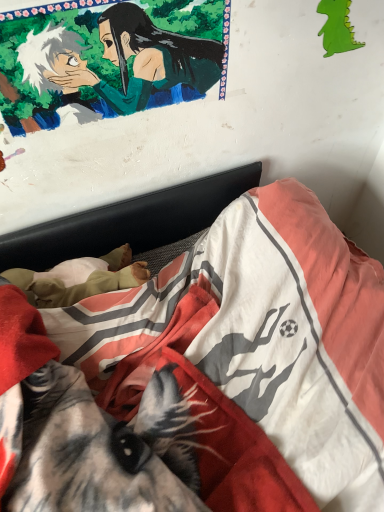
Question: Are smooth green fabric at upper left and green paper dragon at upper right far apart?

Choices:
 (A) no
 (B) yes

Answer: (A)

Question: Considering the relative sizes of smooth green fabric at upper left and green paper dragon at upper right in the image provided, is smooth green fabric at upper left bigger than green paper dragon at upper right?

Choices:
 (A) no
 (B) yes

Answer: (B)

Question: From the image's perspective, would you say smooth green fabric at upper left is shown under green paper dragon at upper right?

Choices:
 (A) yes
 (B) no

Answer: (A)

Question: From a real-world perspective, is smooth green fabric at upper left located higher than green paper dragon at upper right?

Choices:
 (A) no
 (B) yes

Answer: (B)

Question: Does smooth green fabric at upper left have a smaller size compared to green paper dragon at upper right?

Choices:
 (A) no
 (B) yes

Answer: (A)

Question: From a real-world perspective, is smooth green fabric at upper left above or below soft cotton bed at center?

Choices:
 (A) below
 (B) above

Answer: (B)

Question: Is smooth green fabric at upper left taller or shorter than soft cotton bed at center?

Choices:
 (A) tall
 (B) short

Answer: (B)

Question: Is smooth green fabric at upper left to the left or to the right of soft cotton bed at center in the image?

Choices:
 (A) right
 (B) left

Answer: (B)

Question: Does point coord(109,93) appear closer or farther from the camera than point coord(170,420)?

Choices:
 (A) closer
 (B) farther

Answer: (A)

Question: In terms of width, does smooth green fabric at upper left look wider or thinner when compared to green paper dragon at upper right?

Choices:
 (A) wide
 (B) thin

Answer: (A)

Question: Would you say smooth green fabric at upper left is inside or outside green paper dragon at upper right?

Choices:
 (A) outside
 (B) inside

Answer: (A)

Question: From the image's perspective, is smooth green fabric at upper left above or below green paper dragon at upper right?

Choices:
 (A) below
 (B) above

Answer: (A)

Question: Looking at the image, does smooth green fabric at upper left seem bigger or smaller compared to green paper dragon at upper right?

Choices:
 (A) big
 (B) small

Answer: (A)

Question: Would you say green paper dragon at upper right is to the left or to the right of smooth green fabric at upper left in the picture?

Choices:
 (A) left
 (B) right

Answer: (B)

Question: Is green paper dragon at upper right inside the boundaries of smooth green fabric at upper left, or outside?

Choices:
 (A) inside
 (B) outside

Answer: (B)